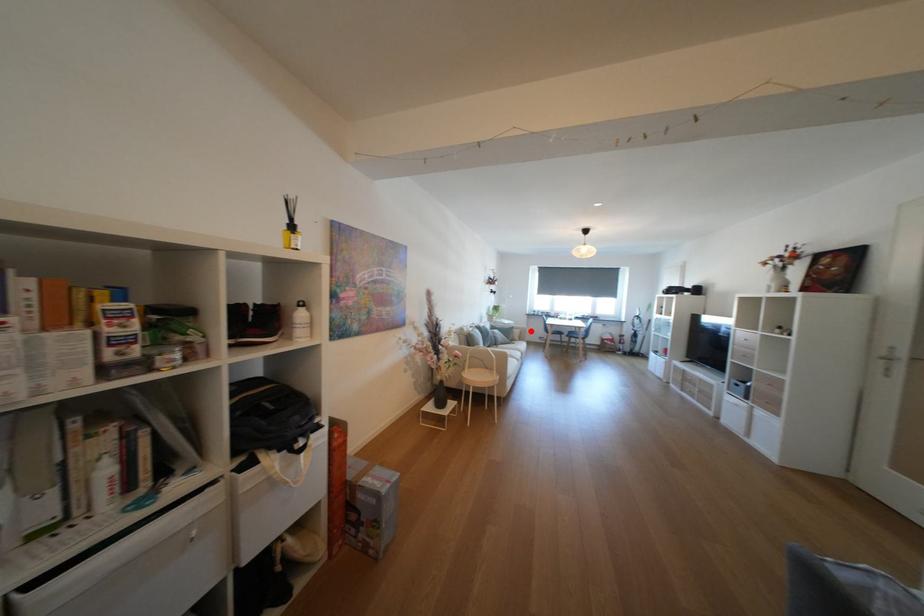
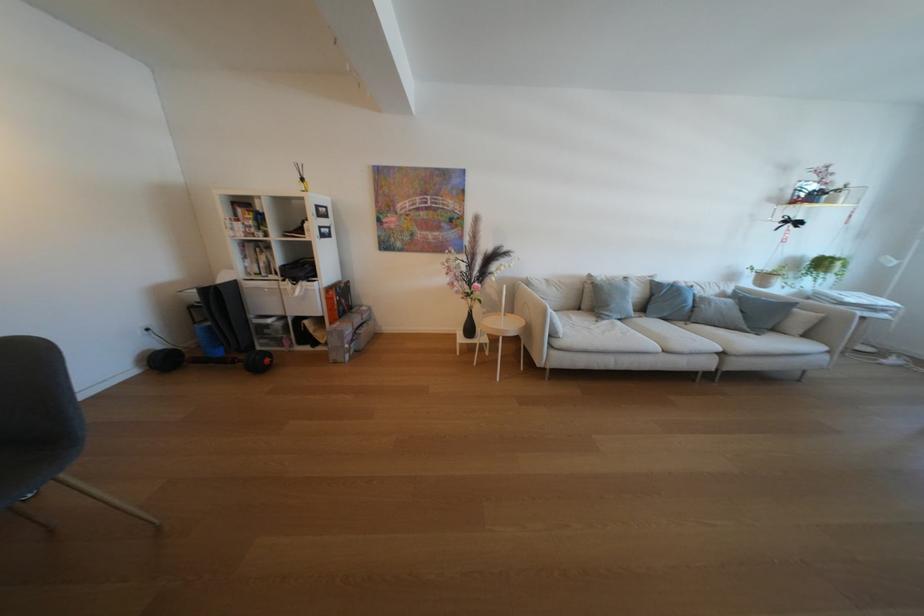
Question: A red point is marked in image1. In image2, is the corresponding 3D point closer to the camera or farther? Reply with the corresponding letter.

Choices:
 (A) The corresponding 3D point is closer.
 (B) The corresponding 3D point is farther.

Answer: (A)